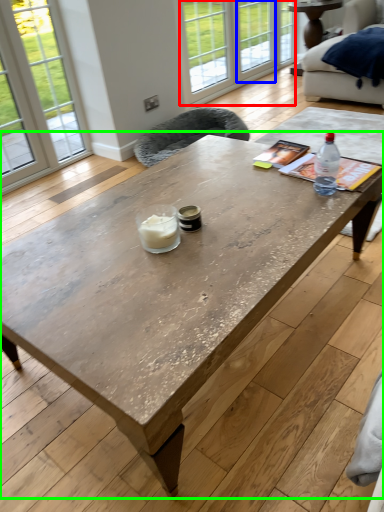
Question: Which is farther away from glass door (highlighted by a red box)? window (highlighted by a blue box) or coffee table (highlighted by a green box)?

Choices:
 (A) window
 (B) coffee table

Answer: (B)